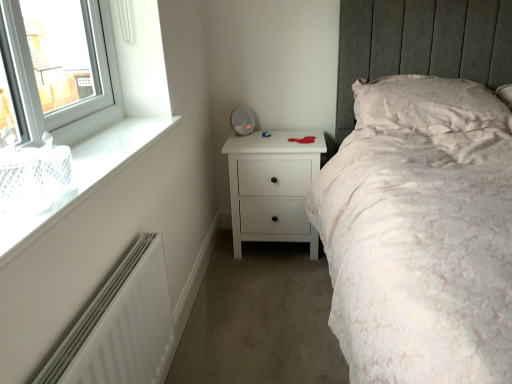
Question: Considering their positions, is white textured pillow at upper right located in front of or behind white glass window at upper left?

Choices:
 (A) behind
 (B) front

Answer: (A)

Question: Is white textured pillow at upper right bigger or smaller than white glass window at upper left?

Choices:
 (A) small
 (B) big

Answer: (B)

Question: Which of these objects is positioned closest to the white textured pillow at upper right?

Choices:
 (A) white matte radiator at lower left
 (B) white glass window at upper left
 (C) white matte chest of drawers at center

Answer: (C)

Question: Which object is the farthest from the white matte chest of drawers at center?

Choices:
 (A) white matte radiator at lower left
 (B) white textured pillow at upper right
 (C) white glass window at upper left

Answer: (A)